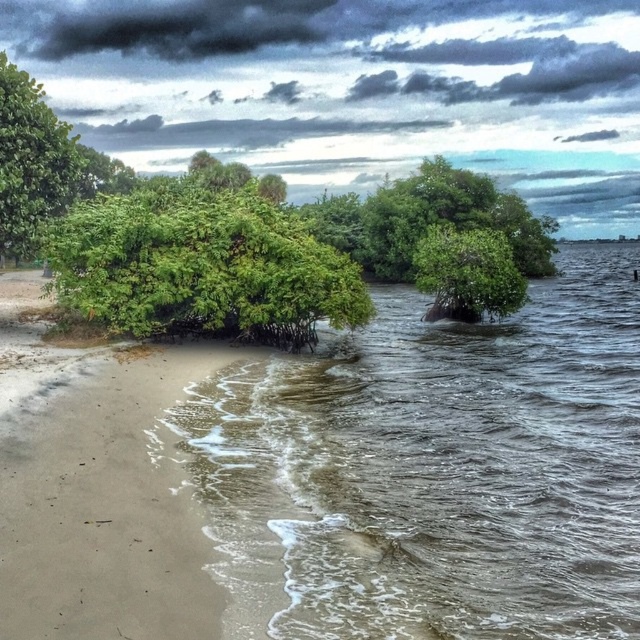
Based on the photo, you are a photographer standing on the beach and want to capture both the brown murky water at center and the green leafy tree at left in your shot. Based on their positions, which one will appear closer to the camera in the photo?

The brown murky water at center appears closer to the camera because it is positioned in front of the green leafy tree at left in the scene.

You are a bird looking for a nesting spot. You see the green leafy bush at left and the green leafy tree at center. Which one is taller and would provide a better vantage point?

The green leafy bush at left is taller than the green leafy tree at center, so it would provide a better vantage point for nesting.

In the coastal scene, there is a green leafy bush at left and a green leafy tree at left. Which one is taller?

The green leafy bush at left is taller than the green leafy tree at left.